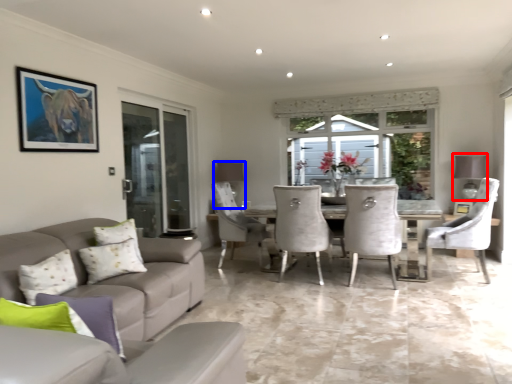
Question: Among these objects, which one is farthest to the camera, lamp (highlighted by a red box) or lamp (highlighted by a blue box)?

Choices:
 (A) lamp
 (B) lamp

Answer: (B)